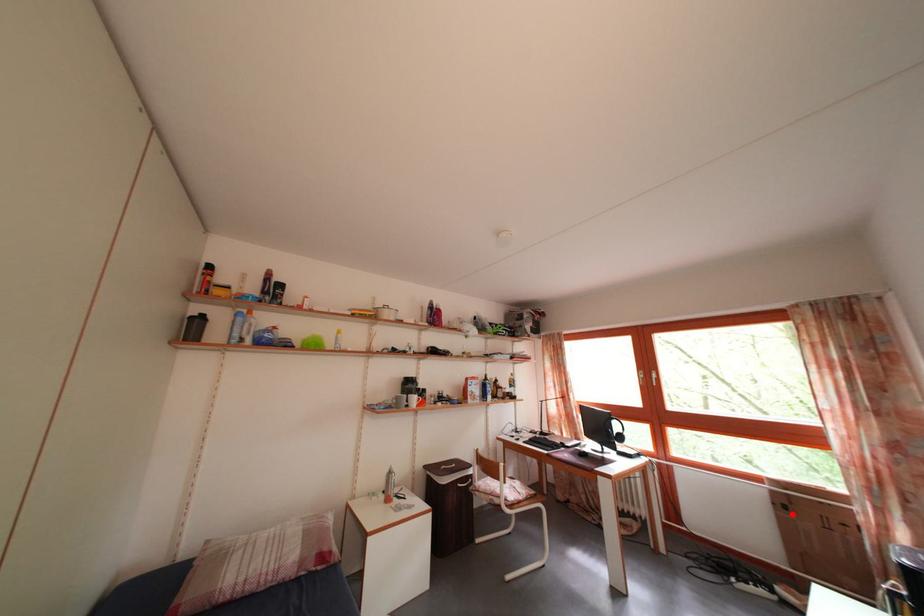
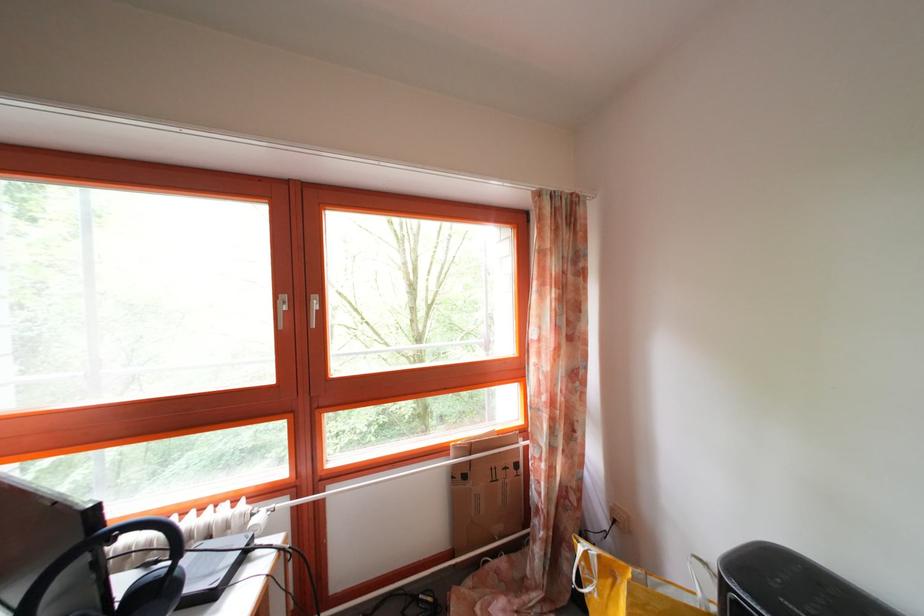
Question: I am providing you with two images of the same scene from different viewpoints. A red point is shown in image1. For the corresponding object point in image2, is it positioned nearer or farther from the camera?

Choices:
 (A) Nearer
 (B) Farther

Answer: (B)